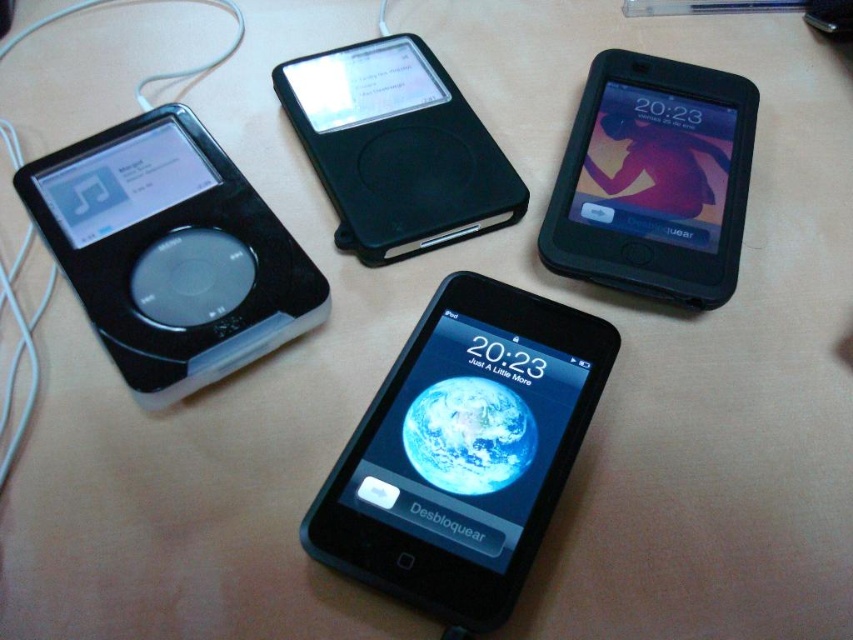
You are arranging items on a desk and want to place a new item between the black matte phone at center and the black plastic ipod at left. Is there enough space between them for the new item?

The black matte phone at center is positioned under the black plastic ipod at left, so there is no vertical space between them to place the new item.

You are standing in front of the four electronic devices on the light wooden surface. There are two points marked on the surface. One is at coordinate point (x=498, y=499) and the other is at coordinate point (x=292, y=64). Which of these two points is closer to you?

Point (x=498, y=499) is closer to the camera than point (x=292, y=64).

You are organizing a display of vintage electronics and need to place a new item between the black matte phone at center and the black plastic ipod at left. The new item is 12 inches long. Will it fit in the space between them?

The distance between the black matte phone at center and the black plastic ipod at left is 14.34 inches. Since the new item is 12 inches long, it will fit comfortably within the available space.